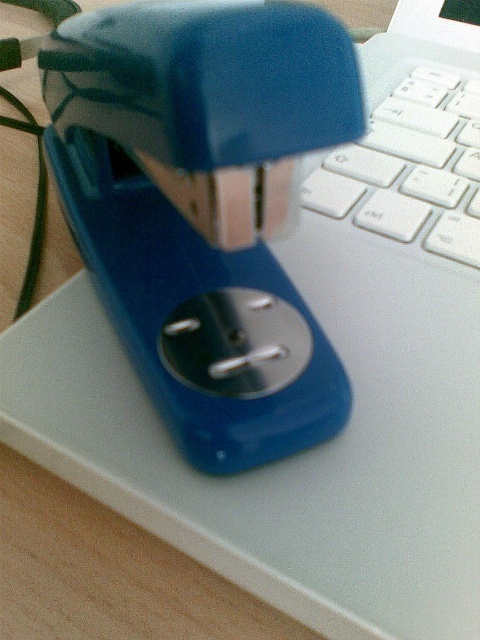
You are organizing your desk and want to place a small note on top of the object that is closer to you between the blue plastic stapler at center and the white plastic keyboard at upper right. Which object should you place it on?

The blue plastic stapler at center is closer to the viewer than the white plastic keyboard at upper right, so you should place the note on the blue plastic stapler at center.

You are organizing your desk and need to place a blue plastic stapler at center. Where exactly should you put it on the desk?

The blue plastic stapler at center should be placed at the coordinates point [192,221].

You are organizing your desk and need to place a 10 inch long document between the blue plastic stapler at center and the white plastic keyboard at upper right. Is there enough space between them to fit the document?

The distance between the blue plastic stapler at center and the white plastic keyboard at upper right is 8.72 inches. Since the document is 10 inches long, it would not fit between them as the space is smaller than the document.